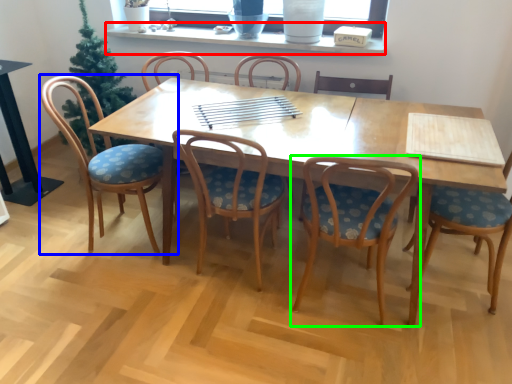
Question: Estimate the real-world distances between objects in this image. Which object is farther from window sill (highlighted by a red box), chair (highlighted by a blue box) or chair (highlighted by a green box)?

Choices:
 (A) chair
 (B) chair

Answer: (B)